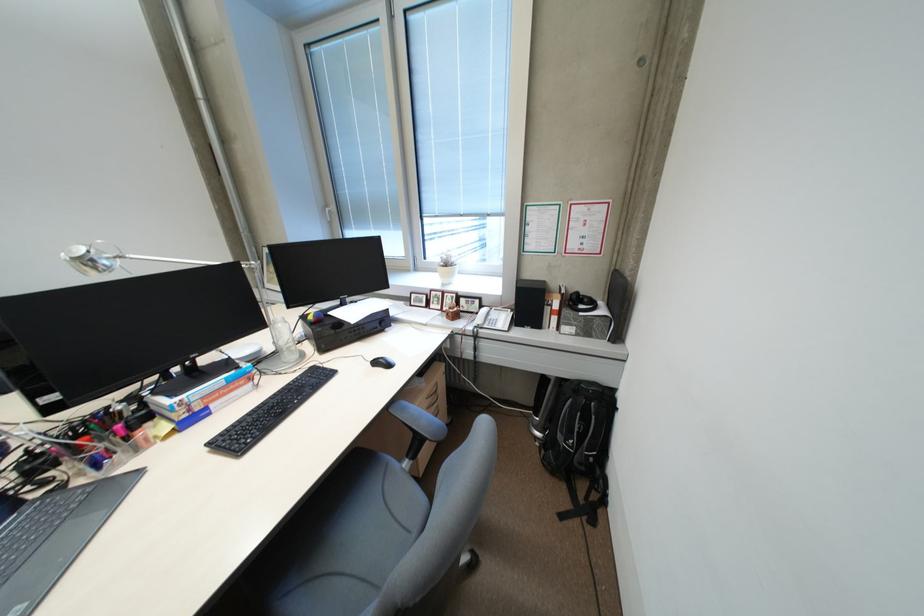
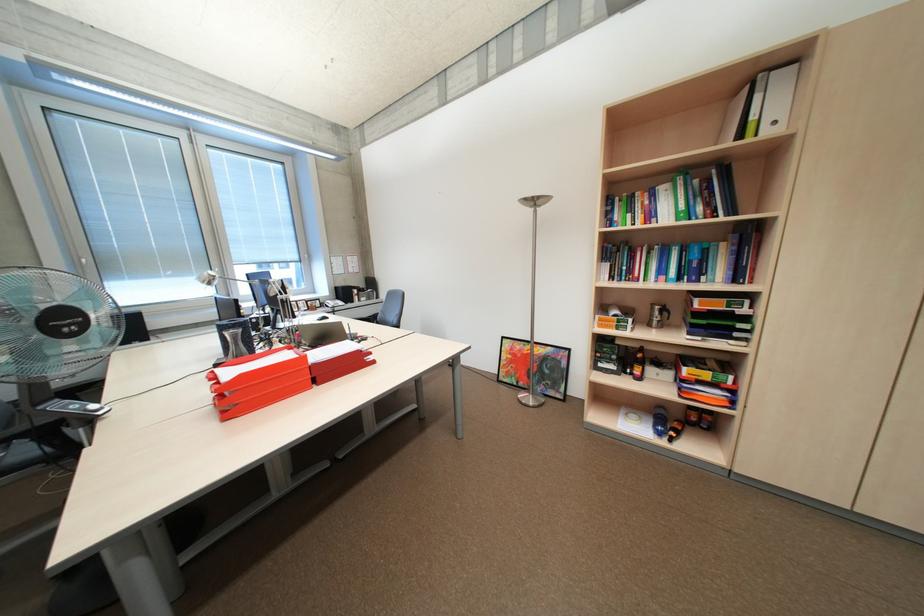
Question: I am providing you with two images of the same scene from different viewpoints. Please identify which objects are invisible in image2.

Choices:
 (A) moka pot handle
 (B) red file organizer
 (C) trash bin lid
 (D) chair sitting surface

Answer: (D)